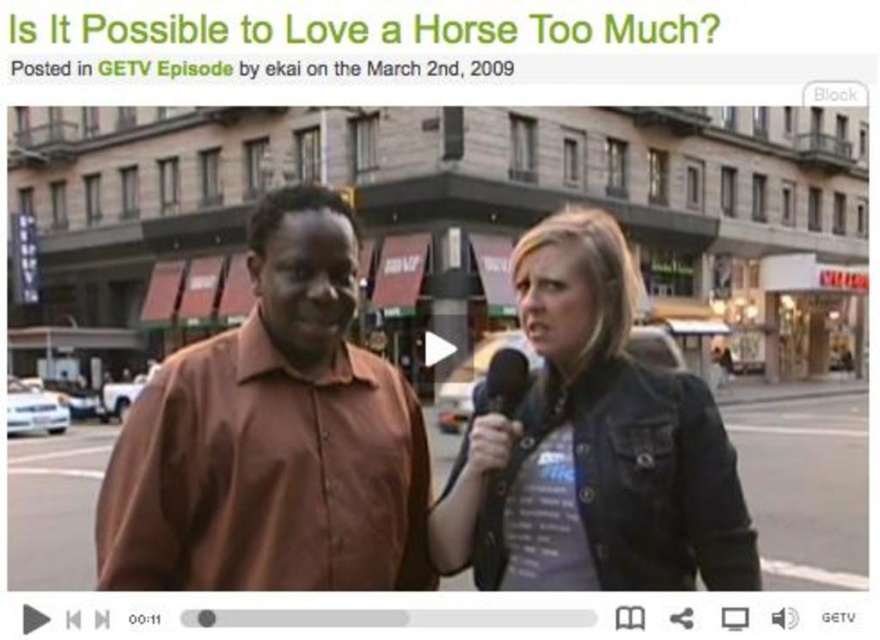
Where is the brown shirt at center located in the image?

The brown shirt at center is located at point 0.684 on the x axis and 0.311 on the y axis.

From the picture: You are standing in front of a screen showing the video described. You want to know if you can reach the denim jacket at center from your current position. The screen is 6 feet away from you. Can you reach it?

The denim jacket at center and viewer are 5.97 feet apart from each other. Since the screen is 6 feet away, you cannot physically reach the denim jacket at center as it is slightly closer than the screen distance.

You are a camera operator filming a scene where the denim jacket at center and the black matte microphone at center are both in frame. The director wants to zoom in on the microphone while keeping the jacket visible. Should you pan the camera to the right or left to achieve this?

The denim jacket at center is to the left of the black matte microphone at center. To zoom in on the microphone while keeping the jacket visible, you should pan the camera to the left. This way, the microphone remains in focus, and the jacket stays within the frame on its left side.